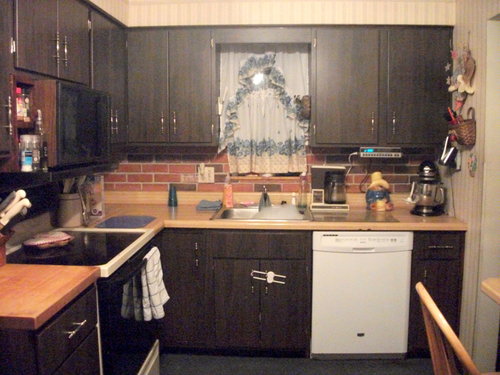
This screenshot has width=500, height=375. Find the location of `safety lock`. safety lock is located at coordinates (270, 279).